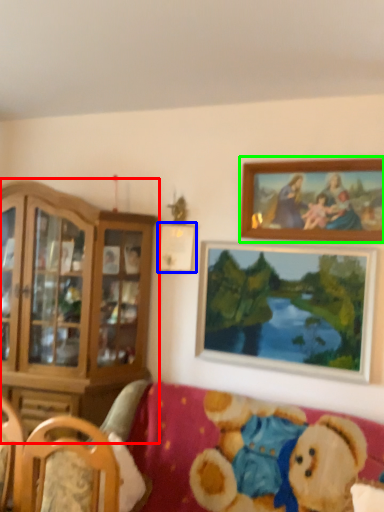
Question: Which is farther away from cabinetry (highlighted by a red box)? picture frame (highlighted by a blue box) or picture frame (highlighted by a green box)?

Choices:
 (A) picture frame
 (B) picture frame

Answer: (B)